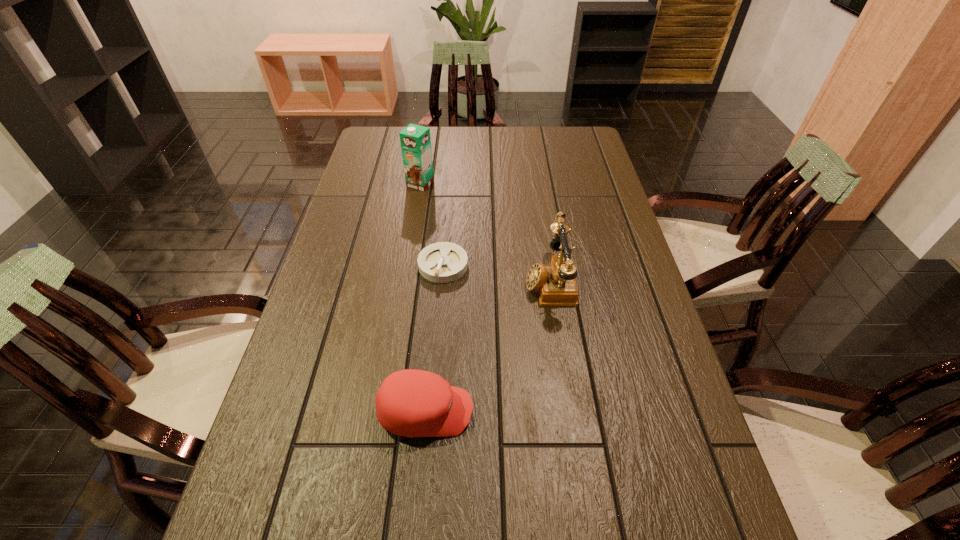
Locate an element on the screen. This screenshot has height=540, width=960. vacant point located 0.150m on the front-facing side of the cap is located at coordinates (544, 411).

Locate an element on the screen. This screenshot has width=960, height=540. free spot located 0.320m on the right of the shortest object is located at coordinates (581, 265).

Image resolution: width=960 pixels, height=540 pixels. What are the coordinates of `free spot at the far edge of the desktop` in the screenshot? It's located at tap(480, 158).

In the image, there is a desktop. Where is `vacant area at the left edge`? vacant area at the left edge is located at coordinates (280, 414).

The width and height of the screenshot is (960, 540). In the image, there is a desktop. In order to click on vacant space at the right edge in this screenshot , I will do `click(620, 277)`.

Where is `vacant space at the far right corner of the desktop`? The image size is (960, 540). vacant space at the far right corner of the desktop is located at coordinates click(x=572, y=137).

Find the location of a particular element. unoccupied position between the second tallest object and the cap is located at coordinates (488, 346).

Image resolution: width=960 pixels, height=540 pixels. In order to click on free space between the nearest object and the farthest object in this screenshot , I will do `click(423, 298)`.

Locate an element on the screen. vacant space that's between the cap and the shortest object is located at coordinates (435, 338).

At what (x,y) coordinates should I click in order to perform the action: click on unoccupied position between the farthest object and the third shortest object. Please return your answer as a coordinate pair (x, y). Looking at the image, I should click on (485, 232).